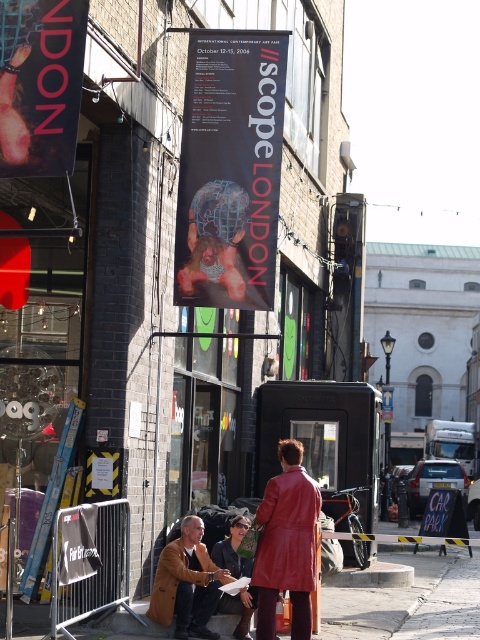
Which is more to the left, black matte poster at center or red leather trench coat at lower center?

From the viewer's perspective, red leather trench coat at lower center appears more on the left side.

Where is `black matte poster at center`? This screenshot has height=640, width=480. black matte poster at center is located at coordinates (229, 168).

Who is more distant from viewer, (212, 218) or (180, 621)?

The point (212, 218) is behind.

Identify the location of black matte poster at center. Image resolution: width=480 pixels, height=640 pixels. (229, 168).

Can you confirm if leather coat at center is positioned to the right of leather jacket at center?

Indeed, leather coat at center is positioned on the right side of leather jacket at center.

Between leather coat at center and leather jacket at center, which one has more height?

leather coat at center is taller.

Who is more distant from viewer, (292, 472) or (245, 621)?

Positioned behind is point (245, 621).

This screenshot has height=640, width=480. Identify the location of leather coat at center. (287, 544).

Does matte pink banner at upper left appear on the right side of leather coat at center?

In fact, matte pink banner at upper left is to the left of leather coat at center.

Where is `matte pink banner at upper left`? The height and width of the screenshot is (640, 480). matte pink banner at upper left is located at coordinates (39, 84).

Is point (49, 132) closer to viewer compared to point (319, 508)?

Yes, point (49, 132) is in front of point (319, 508).

The width and height of the screenshot is (480, 640). Find the location of `matte pink banner at upper left`. matte pink banner at upper left is located at coordinates (39, 84).